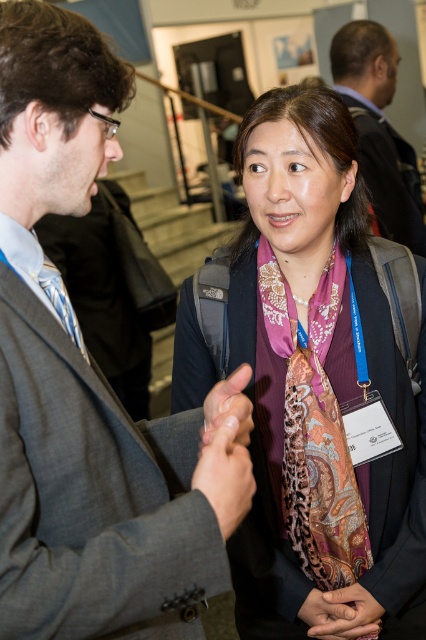
From the picture: You are attending a conference and need to locate your colleague who is wearing a gray suit at center. You see a dark brown leather jacket at upper right. Based on their positions, which direction should you look to find your colleague?

The gray suit at center is positioned under the dark brown leather jacket at upper right, so you should look downward from the dark brown leather jacket at upper right to find your colleague wearing the gray suit at center.